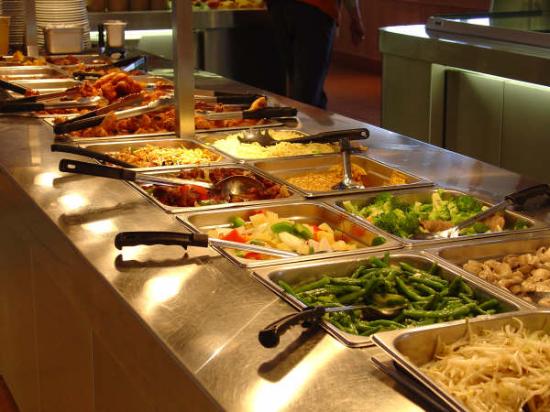
The height and width of the screenshot is (412, 550). I want to click on spoon handle, so click(98, 167), click(164, 236), click(280, 327), click(273, 108).